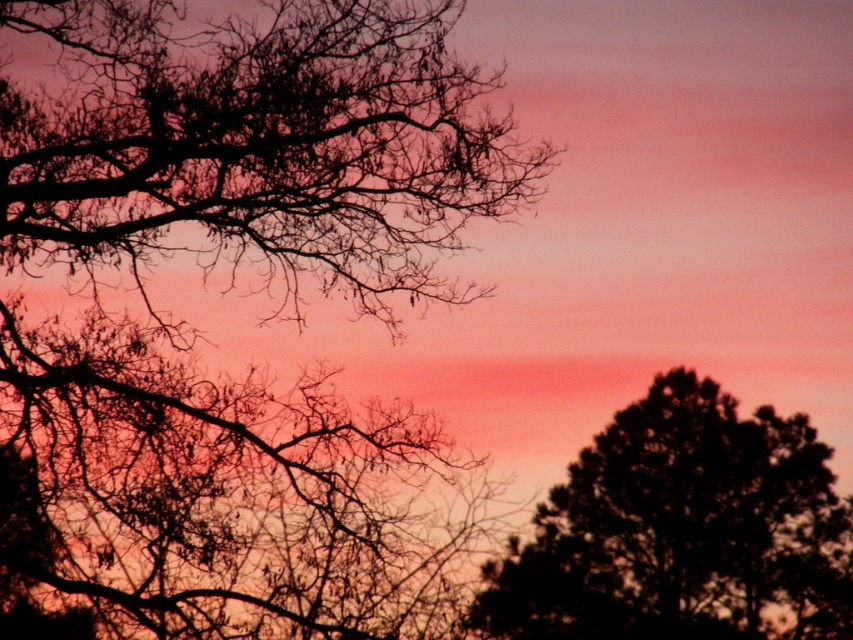
Can you confirm if silhouette tree at upper left is thinner than dark green textured tree at right?

In fact, silhouette tree at upper left might be wider than dark green textured tree at right.

Is silhouette tree at upper left closer to camera compared to dark green textured tree at right?

Yes, silhouette tree at upper left is in front of dark green textured tree at right.

Between point (405, 22) and point (584, 451), which one is positioned in front?

Point (405, 22) is more forward.

Locate an element on the screen. The width and height of the screenshot is (853, 640). silhouette tree at upper left is located at coordinates (234, 285).